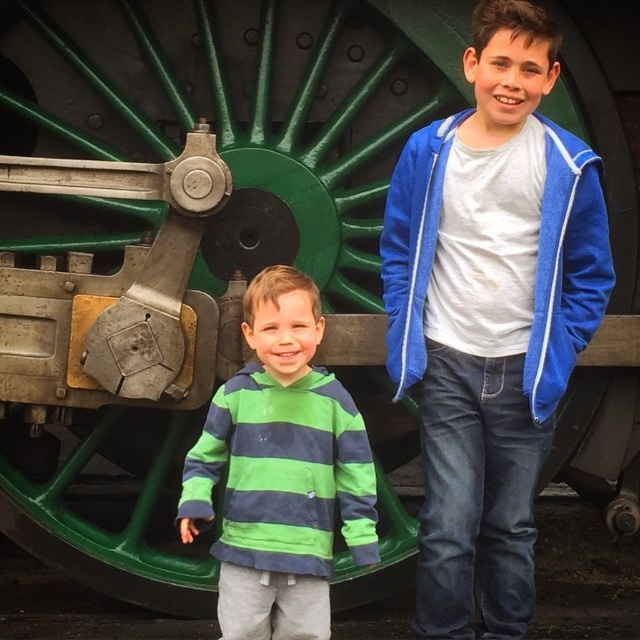
You are a photographer trying to capture both the green striped hoodie at center and the blue fleece jacket at upper right in a single frame. Since the camera has a limited depth of field, which clothing item should you focus on to ensure it appears sharp while the other might be slightly blurred?

The green striped hoodie at center has a larger size compared to the blue fleece jacket at upper right, so focusing on the green striped hoodie at center will ensure it appears sharp while the smaller blue fleece jacket at upper right may be slightly blurred due to the camera having a limited depth of field.

Based on the scene description, which object is taller between the green striped hoodie at center and the blue fleece jacket at upper right?

The green striped hoodie at center is much taller than the blue fleece jacket at upper right according to the description.

You are a photographer trying to capture both the green striped hoodie at center and the blue fleece jacket at upper right in a single frame. Since the camera has a limited field of view, you need to adjust your position to ensure both are fully visible. Which direction should you move to make sure both items fit into the frame?

The green striped hoodie at center is wider than the blue fleece jacket at upper right, so you should move closer to the green striped hoodie at center to ensure both items fit into the frame.